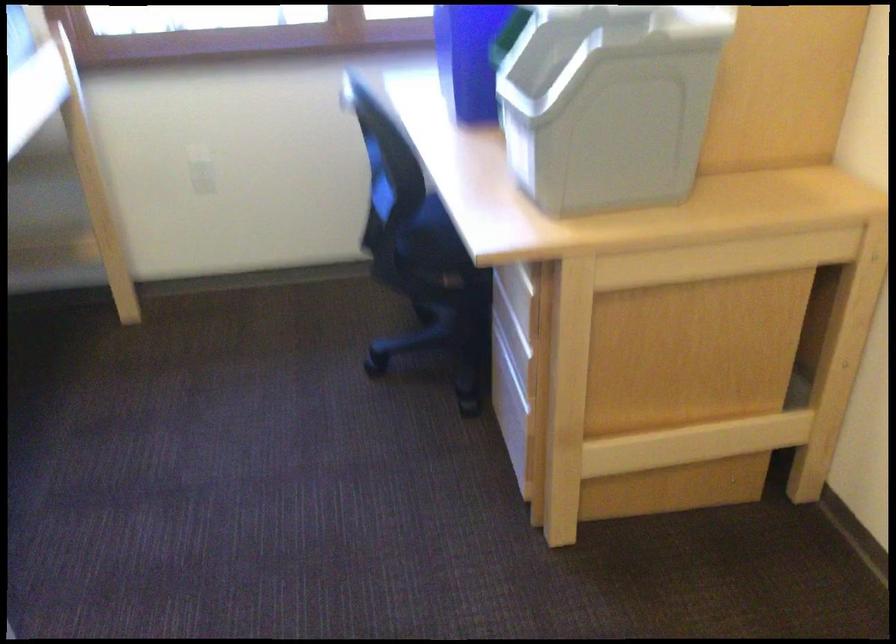
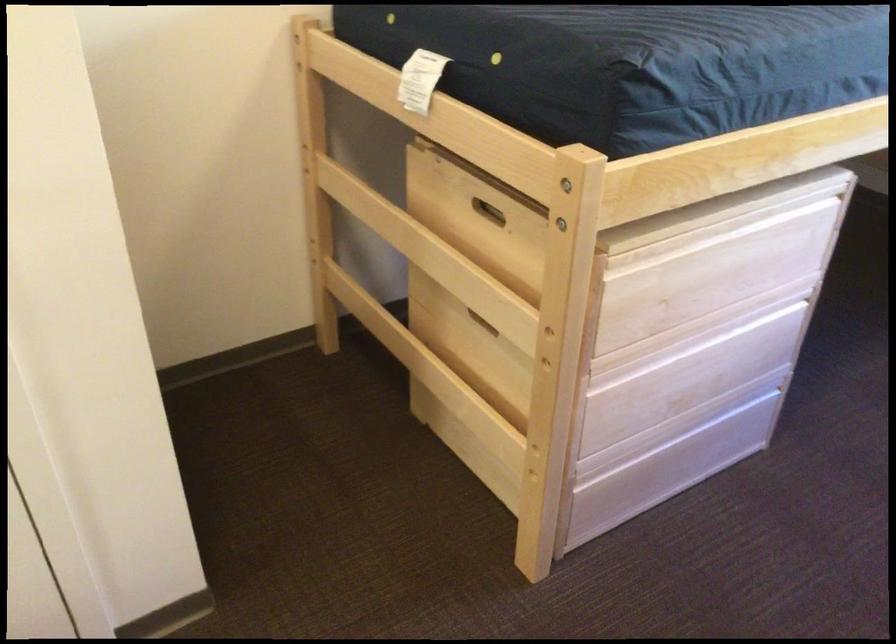
First-person continuous shooting, in which direction is the camera rotating?

The camera rotated toward left-down.